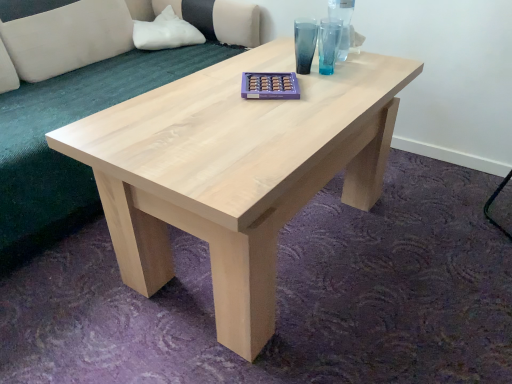
Question: Is transparent glass vase at upper center situated inside natural wood coffee table at center or outside?

Choices:
 (A) inside
 (B) outside

Answer: (B)

Question: Considering the relative positions of transparent glass vase at upper center and natural wood coffee table at center in the image provided, is transparent glass vase at upper center to the left or to the right of natural wood coffee table at center?

Choices:
 (A) left
 (B) right

Answer: (B)

Question: Based on their relative distances, which object is farther from the white fabric pillow at upper left?

Choices:
 (A) transparent glass vase at upper center
 (B) light beige fabric couch at upper left
 (C) natural wood coffee table at center

Answer: (C)

Question: Which of these objects is positioned closest to the transparent glass vase at upper center?

Choices:
 (A) natural wood coffee table at center
 (B) light beige fabric couch at upper left
 (C) white fabric pillow at upper left

Answer: (A)